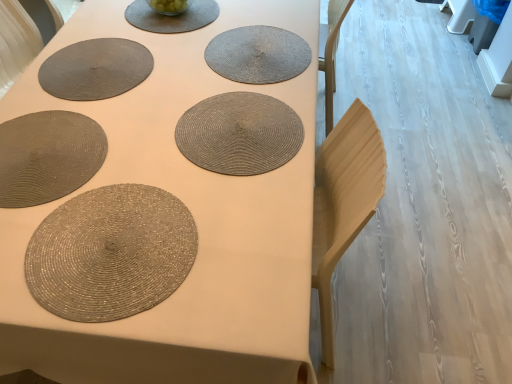
At what (x,y) coordinates should I click in order to perform the action: click on free point in front of matte gray placemat at upper center. Please return your answer as a coordinate pair (x, y). The height and width of the screenshot is (384, 512). Looking at the image, I should click on (178, 48).